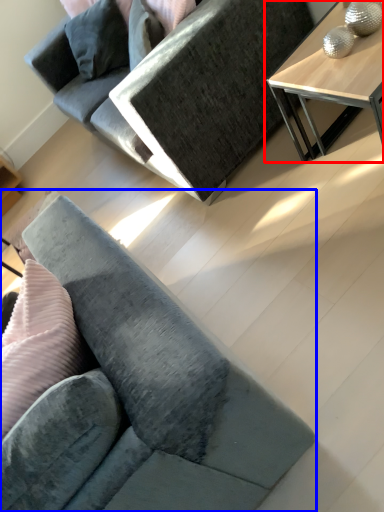
Question: Among these objects, which one is nearest to the camera, table (highlighted by a red box) or studio couch (highlighted by a blue box)?

Choices:
 (A) table
 (B) studio couch

Answer: (B)